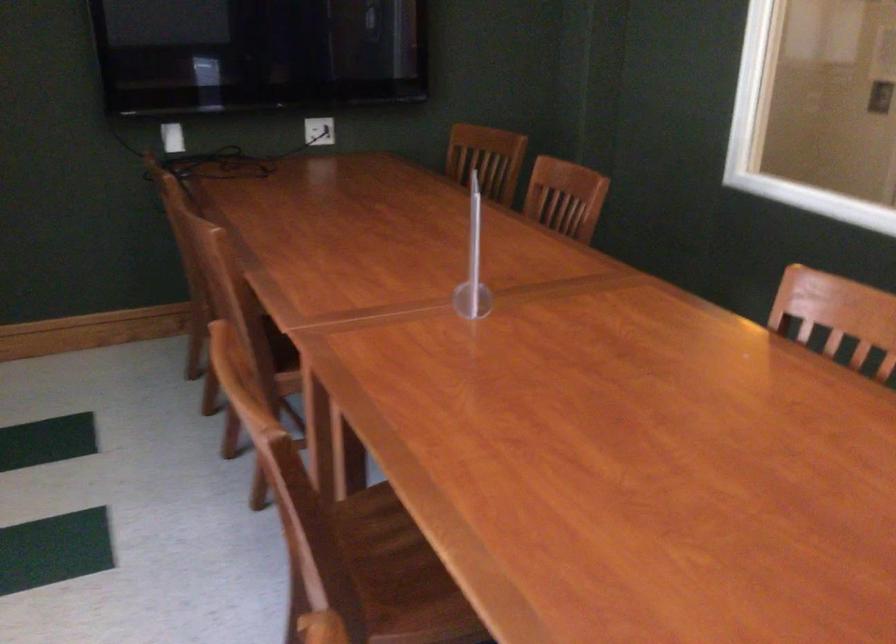
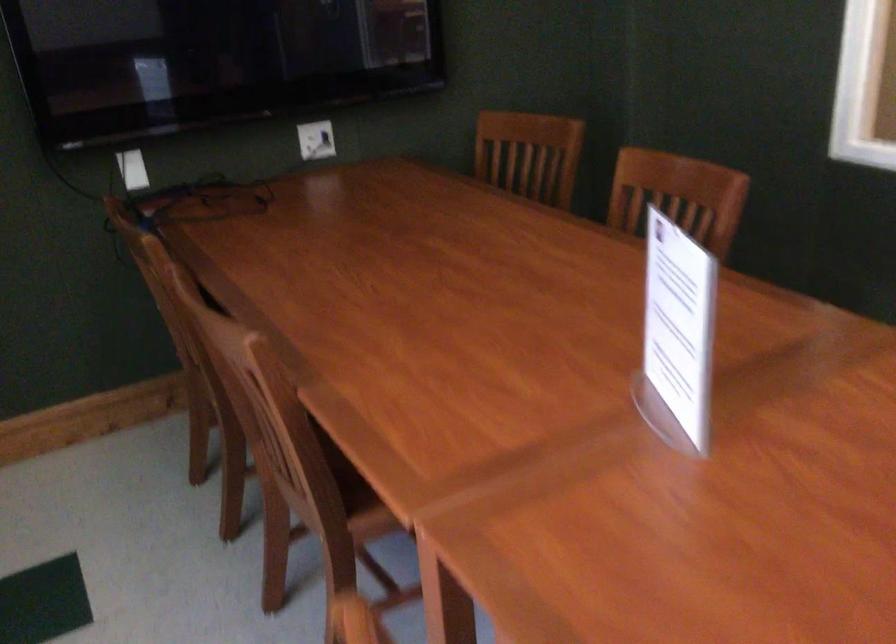
Locate, in the second image, the point that corresponds to [487,156] in the first image.

(529, 154)